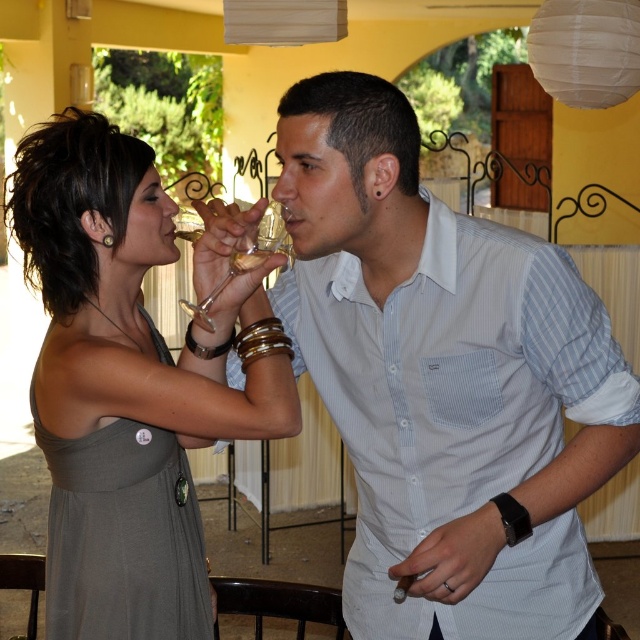
In the scene shown: Can you confirm if matte gray dress at center is thinner than clear glass wine at upper center?

No, matte gray dress at center is not thinner than clear glass wine at upper center.

Is matte gray dress at center bigger than clear glass wine at upper center?

Yes, matte gray dress at center is bigger than clear glass wine at upper center.

Find the location of a particular element. This screenshot has width=640, height=640. matte gray dress at center is located at coordinates (129, 384).

Does transparent glass wine glass at center have a greater height compared to translucent glass at upper center?

Yes, transparent glass wine glass at center is taller than translucent glass at upper center.

Can you confirm if transparent glass wine glass at center is smaller than translucent glass at upper center?

No, transparent glass wine glass at center is not smaller than translucent glass at upper center.

Between point (275, 214) and point (243, 272), which one is positioned behind?

The point (275, 214) is more distant.

Locate an element on the screen. The height and width of the screenshot is (640, 640). transparent glass wine glass at center is located at coordinates (244, 257).

Does white striped shirt at center appear on the right side of translucent glass at upper center?

Yes, white striped shirt at center is to the right of translucent glass at upper center.

Does point (403, 216) come in front of point (259, 262)?

No, it is behind (259, 262).

Identify the location of white striped shirt at center. The image size is (640, 640). coord(444,380).